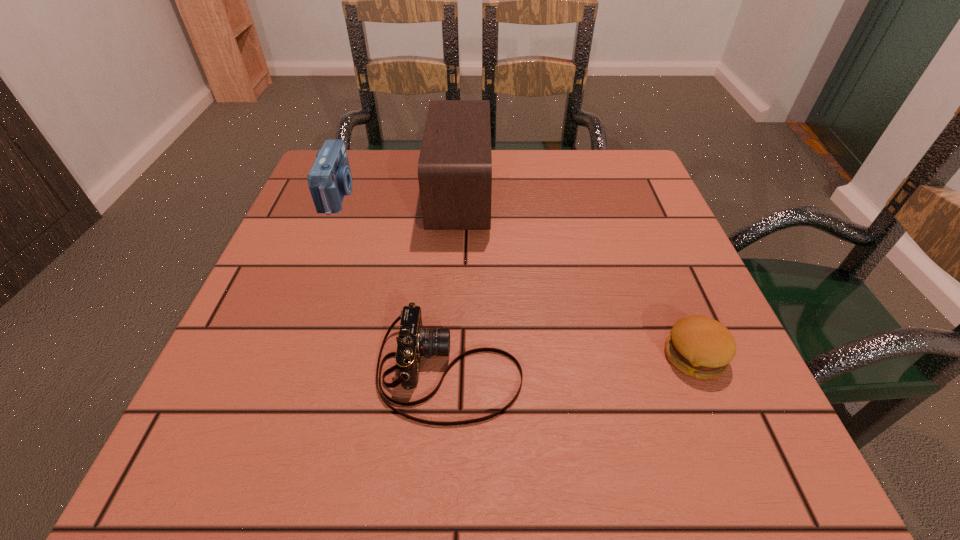
Where is `vacant region that satisfies the following two spatial constraints: 1. on the lens of the rightmost object; 2. on the left side of the second tallest object`? Image resolution: width=960 pixels, height=540 pixels. vacant region that satisfies the following two spatial constraints: 1. on the lens of the rightmost object; 2. on the left side of the second tallest object is located at coordinates (275, 356).

Locate an element on the screen. free space in the image that satisfies the following two spatial constraints: 1. on the back side of the rightmost object; 2. on the front-facing side of the radio receiver is located at coordinates (629, 196).

You are a GUI agent. You are given a task and a screenshot of the screen. Output one action in this format:
    pyautogui.click(x=<x>, y=<y>)
    Task: Click on the vacant space that satisfies the following two spatial constraints: 1. on the lens of the rightmost object; 2. on the right side of the taller camera
    The width and height of the screenshot is (960, 540).
    Given the screenshot: What is the action you would take?
    pyautogui.click(x=275, y=356)

Identify the location of vacant area that satisfies the following two spatial constraints: 1. on the front side of the rightmost object; 2. on the front-facing side of the nearer camera. (700, 370).